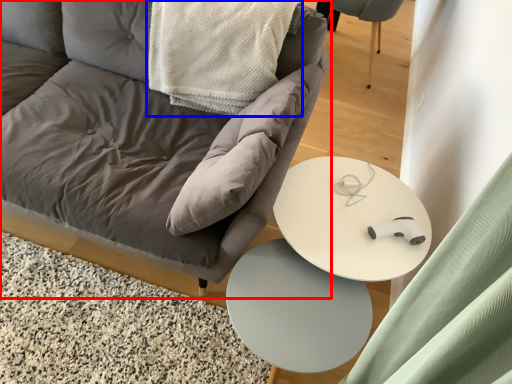
Question: Which of the following is the farthest to the observer, chair (highlighted by a red box) or material (highlighted by a blue box)?

Choices:
 (A) chair
 (B) material

Answer: (B)